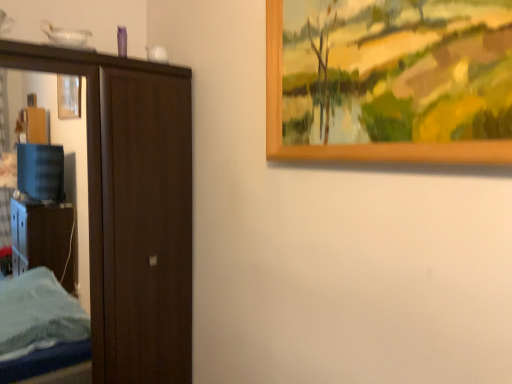
Question: In terms of height, does wooden picture frame at upper right look taller or shorter compared to dark wood door at left?

Choices:
 (A) short
 (B) tall

Answer: (A)

Question: Is point (274, 157) closer or farther from the camera than point (168, 67)?

Choices:
 (A) closer
 (B) farther

Answer: (A)

Question: In the image, is wooden picture frame at upper right positioned in front of or behind dark wood door at left?

Choices:
 (A) behind
 (B) front

Answer: (B)

Question: In the image, is dark wood door at left on the left side or the right side of wooden picture frame at upper right?

Choices:
 (A) right
 (B) left

Answer: (B)

Question: Is dark wood door at left situated inside wooden picture frame at upper right or outside?

Choices:
 (A) outside
 (B) inside

Answer: (A)

Question: Is dark wood door at left wider or thinner than wooden picture frame at upper right?

Choices:
 (A) wide
 (B) thin

Answer: (A)

Question: Considering the positions of point (190, 377) and point (326, 150), is point (190, 377) closer or farther from the camera than point (326, 150)?

Choices:
 (A) farther
 (B) closer

Answer: (A)